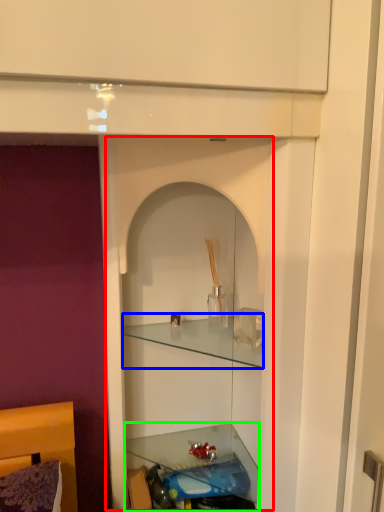
Question: Considering the real-world distances, which object is farthest from cabinet (highlighted by a red box)? cabinet (highlighted by a blue box) or shelf (highlighted by a green box)?

Choices:
 (A) cabinet
 (B) shelf

Answer: (B)